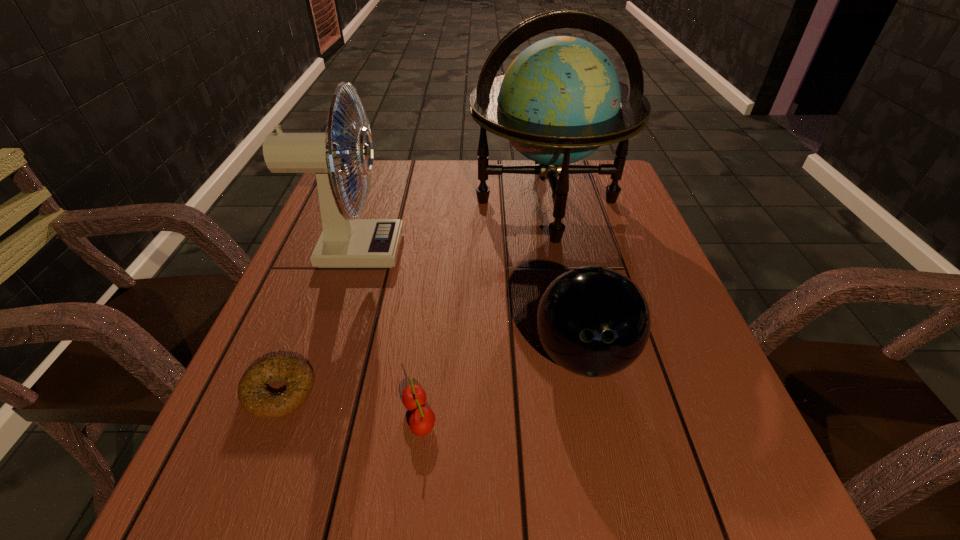
The image size is (960, 540). Find the location of `free space between the globe and the second tallest object`. free space between the globe and the second tallest object is located at coordinates (449, 226).

Find the location of a particular element. The height and width of the screenshot is (540, 960). empty location between the second shortest object and the fourth shortest object is located at coordinates (386, 334).

This screenshot has height=540, width=960. Find the location of `object that is the closest to the fourth shortest object`. object that is the closest to the fourth shortest object is located at coordinates (560, 99).

Find the location of `object identified as the closest to the third tallest object`. object identified as the closest to the third tallest object is located at coordinates (422, 420).

The width and height of the screenshot is (960, 540). I want to click on vacant space that satisfies the following two spatial constraints: 1. on the front-facing side of the fourth shortest object; 2. on the front side of the shortest object, so click(303, 392).

Locate an element on the screen. This screenshot has width=960, height=540. free space that satisfies the following two spatial constraints: 1. on the front side of the fourth tallest object; 2. on the left side of the bagel is located at coordinates (269, 417).

Locate an element on the screen. The image size is (960, 540). free point that satisfies the following two spatial constraints: 1. on the surface of the globe; 2. on the front-facing side of the second tallest object is located at coordinates click(557, 251).

In order to click on free space that satisfies the following two spatial constraints: 1. on the surface of the globe; 2. on the front-facing side of the fan in this screenshot , I will do `click(557, 251)`.